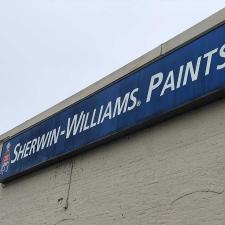
Image resolution: width=225 pixels, height=225 pixels. I want to click on fancy brick work painted tan, so click(188, 189).